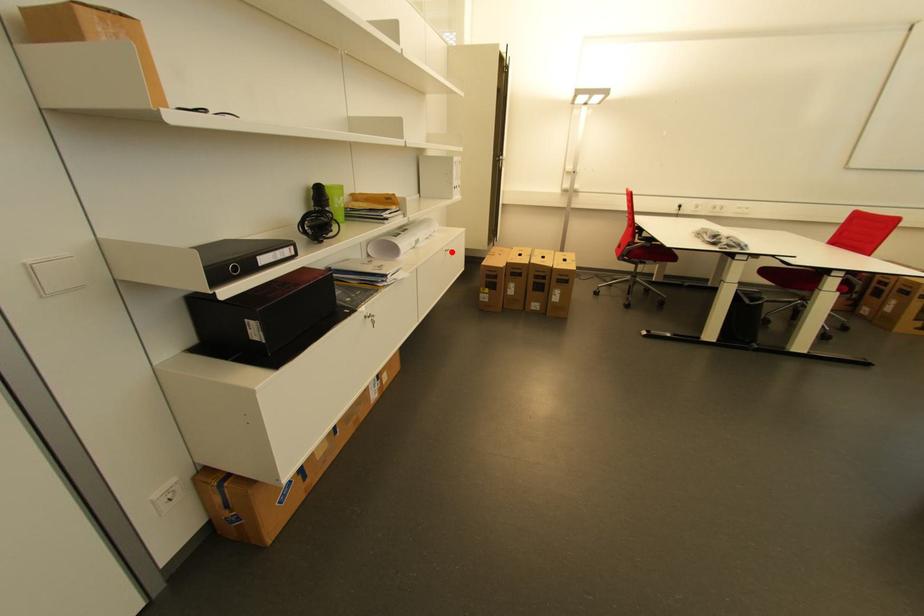
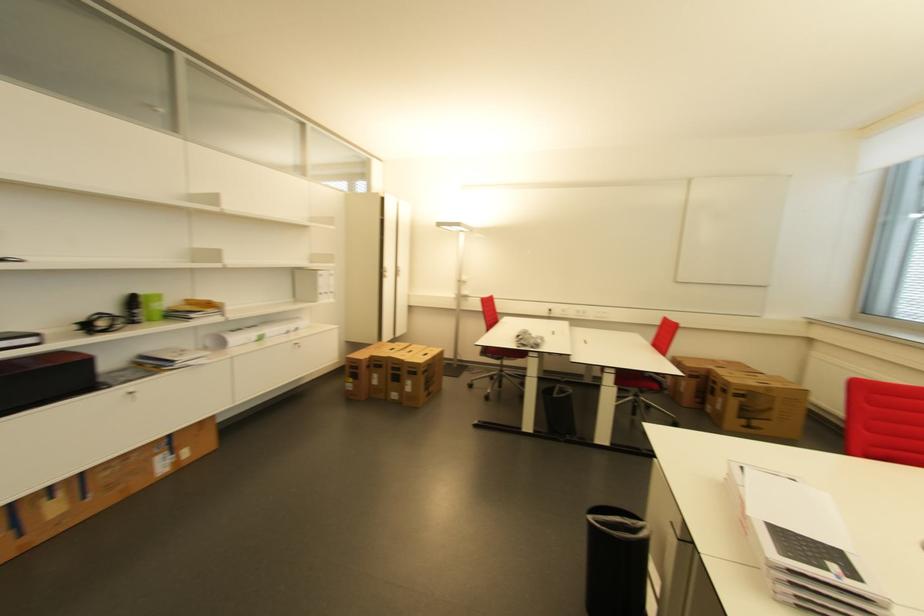
Find the pixel in the second image that matches the highlighted location in the first image.

(300, 345)